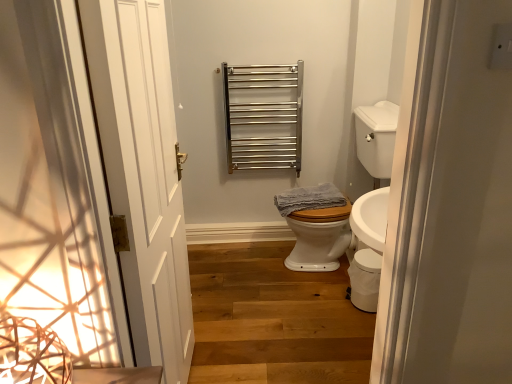
The image size is (512, 384). I want to click on free space to the left of white glossy toilet bowl at lower right, so click(330, 304).